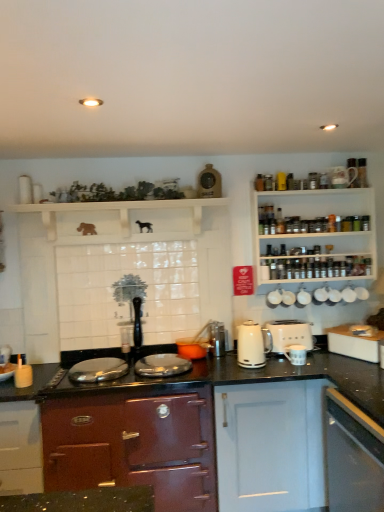
This screenshot has width=384, height=512. What do you see at coordinates (303, 297) in the screenshot?
I see `white glossy cup at upper right, the 2th appliance in the right-to-left sequence` at bounding box center [303, 297].

Based on the photo, how much space does gold metallic clock at upper center, which ranks as the first appliance in top-to-bottom order, occupy vertically?

The height of gold metallic clock at upper center, which ranks as the first appliance in top-to-bottom order, is 9.59 inches.

The height and width of the screenshot is (512, 384). Find the location of `white matte toaster at right`. white matte toaster at right is located at coordinates (289, 334).

This screenshot has height=512, width=384. I want to click on white ceramic mug at lower center, marked as the 1th appliance in a bottom-to-top arrangement, so click(x=296, y=354).

I want to click on white glossy coffee cup at upper right, the first appliance in the right-to-left sequence, so click(348, 295).

This screenshot has height=512, width=384. Find the location of `white glossy electric kettle at center`. white glossy electric kettle at center is located at coordinates coord(252,345).

From a real-world perspective, is white glossy electric kettle at center below white matte wooden shelf at upper center?

Yes, from a real-world perspective, white glossy electric kettle at center is under white matte wooden shelf at upper center.

At what (x,y) coordinates should I click in order to perform the action: click on kitchen appliance lying in front of the white matte wooden shelf at upper center. Please return your answer as a coordinate pair (x, y). Looking at the image, I should click on (252, 345).

Is white glossy electric kettle at center not close to white matte wooden shelf at upper center?

Actually, white glossy electric kettle at center and white matte wooden shelf at upper center are a little close together.

Which object is thinner, white glossy electric kettle at center or white matte wooden shelf at upper center?

Thinner between the two is white glossy electric kettle at center.

Is white glossy coffee cup at upper right, marked as the second appliance in a top-to-bottom arrangement, to the left of white glossy electric kettle at center from the viewer's perspective?

No.

Which point is more forward, (346, 302) or (251, 347)?

Positioned in front is point (251, 347).

Could you tell me if white glossy coffee cup at upper right, which is counted as the fifth appliance, starting from the left, is turned towards white glossy electric kettle at center?

No, white glossy coffee cup at upper right, which is counted as the fifth appliance, starting from the left, is not oriented towards white glossy electric kettle at center.

From their relative heights in the image, would you say white glossy coffee cup at upper right, marked as the second appliance in a top-to-bottom arrangement, is taller or shorter than white glossy electric kettle at center?

Considering their sizes, white glossy coffee cup at upper right, marked as the second appliance in a top-to-bottom arrangement, has less height than white glossy electric kettle at center.

In order to click on kitchen appliance in front of the white matte toaster at right in this screenshot , I will do `click(252, 345)`.

Which object is positioned more to the left, white glossy electric kettle at center or white matte toaster at right?

white glossy electric kettle at center.

Is white glossy electric kettle at center smaller than white matte toaster at right?

Yes.

Is white glossy electric kettle at center far from white matte toaster at right?

Actually, white glossy electric kettle at center and white matte toaster at right are a little close together.

In terms of height, does white ceramic mug at lower center, the 5th appliance from the top, look taller or shorter compared to metallic silver kettle at center, which is the 4th appliance in right-to-left order?

Considering their sizes, white ceramic mug at lower center, the 5th appliance from the top, has less height than metallic silver kettle at center, which is the 4th appliance in right-to-left order.

Considering the sizes of objects white ceramic mug at lower center, marked as the 1th appliance in a bottom-to-top arrangement, and metallic silver kettle at center, which is the 4th appliance in right-to-left order, in the image provided, who is bigger, white ceramic mug at lower center, marked as the 1th appliance in a bottom-to-top arrangement, or metallic silver kettle at center, which is the 4th appliance in right-to-left order,?

With larger size is metallic silver kettle at center, which is the 4th appliance in right-to-left order.

Does white ceramic mug at lower center, which ranks as the 3th appliance in right-to-left order, come in front of metallic silver kettle at center, which is the 4th appliance in right-to-left order?

Yes.

Could you tell me if white ceramic mug at lower center, marked as the 1th appliance in a bottom-to-top arrangement, is turned towards metallic silver kettle at center, which is the 4th appliance in right-to-left order?

No, white ceramic mug at lower center, marked as the 1th appliance in a bottom-to-top arrangement, is not oriented towards metallic silver kettle at center, which is the 4th appliance in right-to-left order.

Is white ceramic mug at lower center, which ranks as the 3th appliance in right-to-left order, bigger than white matte toaster at right?

No.

Which is in front, white ceramic mug at lower center, marked as the 1th appliance in a bottom-to-top arrangement, or white matte toaster at right?

white ceramic mug at lower center, marked as the 1th appliance in a bottom-to-top arrangement, is closer to the camera.

Considering the positions of objects white ceramic mug at lower center, which ranks as the 3th appliance in right-to-left order, and white matte toaster at right in the image provided, who is more to the left, white ceramic mug at lower center, which ranks as the 3th appliance in right-to-left order, or white matte toaster at right?

From the viewer's perspective, white ceramic mug at lower center, which ranks as the 3th appliance in right-to-left order, appears more on the left side.

In terms of width, does white ceramic mug at lower center, marked as the 1th appliance in a bottom-to-top arrangement, look wider or thinner when compared to white matte toaster at right?

Clearly, white ceramic mug at lower center, marked as the 1th appliance in a bottom-to-top arrangement, has less width compared to white matte toaster at right.

From the picture: Is metallic silver kettle at center, the 2th appliance in the left-to-right sequence, far from shiny burgundy cabinet at center, positioned as the first cabinetry in left-to-right order?

Actually, metallic silver kettle at center, the 2th appliance in the left-to-right sequence, and shiny burgundy cabinet at center, positioned as the first cabinetry in left-to-right order, are a little close together.

From a real-world perspective, is metallic silver kettle at center, which is the 4th appliance in right-to-left order, above or below shiny burgundy cabinet at center, the 3th cabinetry from the right?

metallic silver kettle at center, which is the 4th appliance in right-to-left order, is situated higher than shiny burgundy cabinet at center, the 3th cabinetry from the right, in the real world.

Could you measure the distance between metallic silver kettle at center, the second appliance from the bottom, and shiny burgundy cabinet at center, the 3th cabinetry from the right?

metallic silver kettle at center, the second appliance from the bottom, is 27.60 inches away from shiny burgundy cabinet at center, the 3th cabinetry from the right.

Locate an element on the screen. the 3rd appliance behind the shiny burgundy cabinet at center, the 3th cabinetry from the right, counting from the anchor's position is located at coordinates (217, 338).

Starting from the white wooden spice rack at upper right, which appliance is the 2nd one to the left? Please provide its 2D coordinates.

[(296, 354)]

Is white wooden spice rack at upper right oriented towards white ceramic mug at lower center, marked as the 1th appliance in a bottom-to-top arrangement?

No, white wooden spice rack at upper right is not oriented towards white ceramic mug at lower center, marked as the 1th appliance in a bottom-to-top arrangement.

Is white wooden spice rack at upper right with white ceramic mug at lower center, the 5th appliance from the top?

No, white wooden spice rack at upper right is not touching white ceramic mug at lower center, the 5th appliance from the top.

How much distance is there between white wooden spice rack at upper right and white ceramic mug at lower center, the 5th appliance from the top?

The distance of white wooden spice rack at upper right from white ceramic mug at lower center, the 5th appliance from the top, is 30.11 inches.

Image resolution: width=384 pixels, height=512 pixels. In order to click on shelf positioned vertically above the white glossy electric kettle at center (from a real-world perspective) in this screenshot , I will do `click(119, 211)`.

The image size is (384, 512). I want to click on the 5th appliance behind when counting from the white glossy electric kettle at center, so click(x=348, y=295).

Looking at the image, which one is located further to gold metallic clock at upper center, which is the 5th appliance in bottom-to-top order, white glossy cabinet at lower right, the third cabinetry in the left-to-right sequence, or white glossy cup at upper right, the 3th appliance positioned from the bottom?

white glossy cabinet at lower right, the third cabinetry in the left-to-right sequence, is further to gold metallic clock at upper center, which is the 5th appliance in bottom-to-top order.

From the image, which object appears to be nearer to white ceramic mug at lower center, the 5th appliance from the top, white matte toaster at right or gold metallic clock at upper center, which is the 5th appliance in bottom-to-top order?

white matte toaster at right lies closer to white ceramic mug at lower center, the 5th appliance from the top, than the other object.

Considering their positions, is gold metallic clock at upper center, which is the 5th appliance in bottom-to-top order, positioned further to shiny burgundy cabinet at center, the 3th cabinetry from the right, than white glossy electric kettle at center?

Based on the image, gold metallic clock at upper center, which is the 5th appliance in bottom-to-top order, appears to be further to shiny burgundy cabinet at center, the 3th cabinetry from the right.

Estimate the real-world distances between objects in this image. Which object is further from shiny burgundy cabinet at center, the 3th cabinetry from the right, white wooden spice rack at upper right or white matte wooden shelf at upper center?

Among the two, white wooden spice rack at upper right is located further to shiny burgundy cabinet at center, the 3th cabinetry from the right.

Looking at the image, which one is located closer to shiny burgundy cabinet at center, positioned as the first cabinetry in left-to-right order, white matte wooden shelf at upper center or white glossy coffee cup at upper right, marked as the second appliance in a top-to-bottom arrangement?

Based on the image, white matte wooden shelf at upper center appears to be nearer to shiny burgundy cabinet at center, positioned as the first cabinetry in left-to-right order.

Which object lies nearer to the anchor point white glossy electric kettle at center, white matte wooden shelf at upper center or metallic silver kettle at center, which is the 4th appliance in right-to-left order?

Among the two, metallic silver kettle at center, which is the 4th appliance in right-to-left order, is located nearer to white glossy electric kettle at center.

Looking at the image, which one is located further to gold metallic clock at upper center, which is the 5th appliance in bottom-to-top order, white glossy cup at upper right, the 2th appliance in the right-to-left sequence, or white matte cabinet at lower center, acting as the 2th cabinetry starting from the left?

white matte cabinet at lower center, acting as the 2th cabinetry starting from the left, is further to gold metallic clock at upper center, which is the 5th appliance in bottom-to-top order.

When comparing their distances from white matte cabinet at lower center, positioned as the second cabinetry in right-to-left order, does white glossy cup at upper right, the 2th appliance in the right-to-left sequence, or white matte wooden shelf at upper center seem further?

Among the two, white matte wooden shelf at upper center is located further to white matte cabinet at lower center, positioned as the second cabinetry in right-to-left order.

The height and width of the screenshot is (512, 384). Find the location of `shelf between gold metallic clock at upper center, which is the 5th appliance in bottom-to-top order, and white ceramic mug at lower center, the 5th appliance from the top, from top to bottom`. shelf between gold metallic clock at upper center, which is the 5th appliance in bottom-to-top order, and white ceramic mug at lower center, the 5th appliance from the top, from top to bottom is located at coordinates (119, 211).

Locate an element on the screen. This screenshot has width=384, height=512. kitchen appliance between white wooden spice rack at upper right and white matte toaster at right in the up-down direction is located at coordinates (252, 345).

The width and height of the screenshot is (384, 512). In order to click on toaster between metallic silver kettle at center, which is the 4th appliance in right-to-left order, and white glossy cup at upper right, the 3th appliance positioned from the bottom, in the horizontal direction in this screenshot , I will do `click(289, 334)`.

Locate an element on the screen. The height and width of the screenshot is (512, 384). kitchen appliance situated between shiny burgundy cabinet at center, positioned as the first cabinetry in left-to-right order, and white ceramic mug at lower center, marked as the 1th appliance in a bottom-to-top arrangement, from left to right is located at coordinates (252, 345).